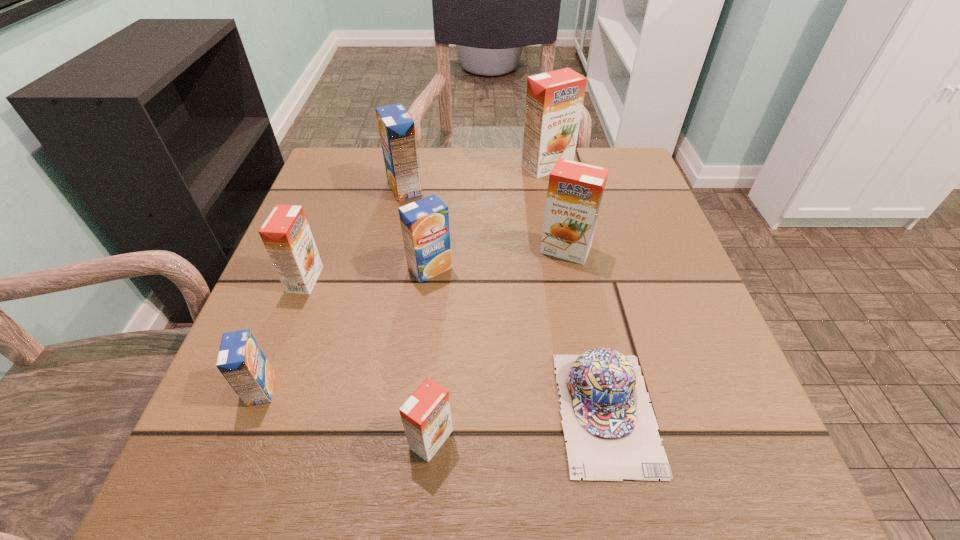
In order to click on the tallest orange_juice in this screenshot , I will do `click(554, 100)`.

Find the location of `the biggest orange orange juice`. the biggest orange orange juice is located at coordinates (554, 100).

Locate an element on the screen. The width and height of the screenshot is (960, 540). the biggest blue orange_juice is located at coordinates (396, 127).

The width and height of the screenshot is (960, 540). I want to click on the third smallest orange orange juice, so click(x=575, y=190).

The image size is (960, 540). Find the location of `the second biggest blue orange_juice`. the second biggest blue orange_juice is located at coordinates (425, 227).

This screenshot has height=540, width=960. I want to click on the third biggest orange orange juice, so click(286, 234).

The image size is (960, 540). In order to click on the third farthest orange orange juice in this screenshot , I will do `click(286, 234)`.

Locate an element on the screen. Image resolution: width=960 pixels, height=540 pixels. the smallest orange orange juice is located at coordinates (426, 416).

Identify the location of the nearest orange orange juice. (426, 416).

Find the location of a particular element. the leftmost blue orange_juice is located at coordinates (241, 361).